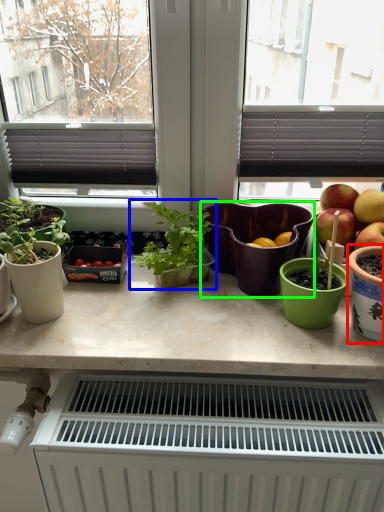
Question: Which object is positioned farthest from flowerpot (highlighted by a red box)? Select from houseplant (highlighted by a blue box) and flowerpot (highlighted by a green box).

Choices:
 (A) houseplant
 (B) flowerpot

Answer: (A)